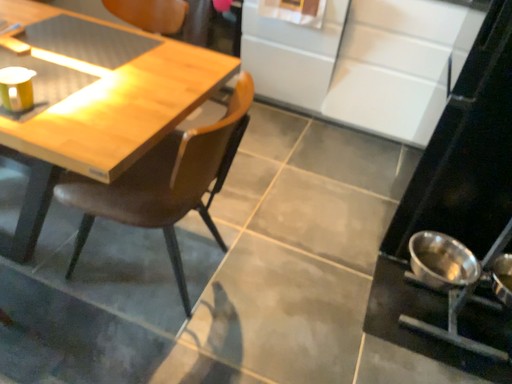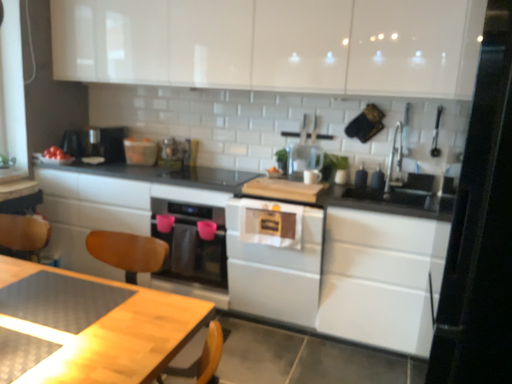
Question: How did the camera likely rotate when shooting the video?

Choices:
 (A) rotated upward
 (B) rotated downward

Answer: (A)